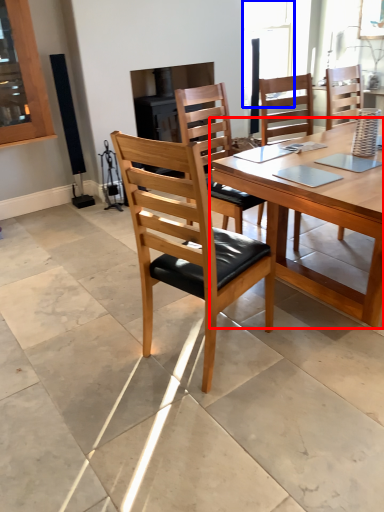
Question: Among these objects, which one is nearest to the camera, kitchen & dining room table (highlighted by a red box) or window (highlighted by a blue box)?

Choices:
 (A) kitchen & dining room table
 (B) window

Answer: (A)